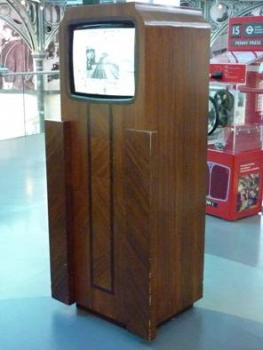
The width and height of the screenshot is (263, 350). I want to click on old tv perhaps, so click(x=90, y=57).